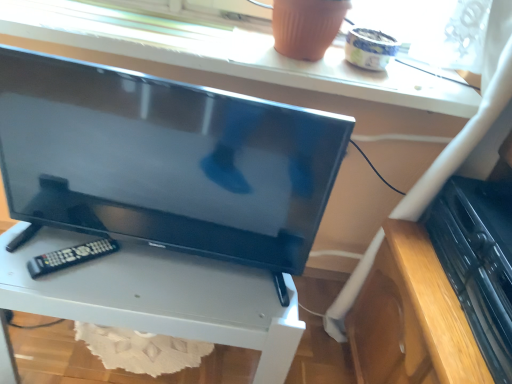
At what (x,y) coordinates should I click in order to perform the action: click on vacant space situated above black plastic dvd player at lower right (from a real-world perspective). Please return your answer as a coordinate pair (x, y). This screenshot has width=512, height=384. Looking at the image, I should click on (493, 207).